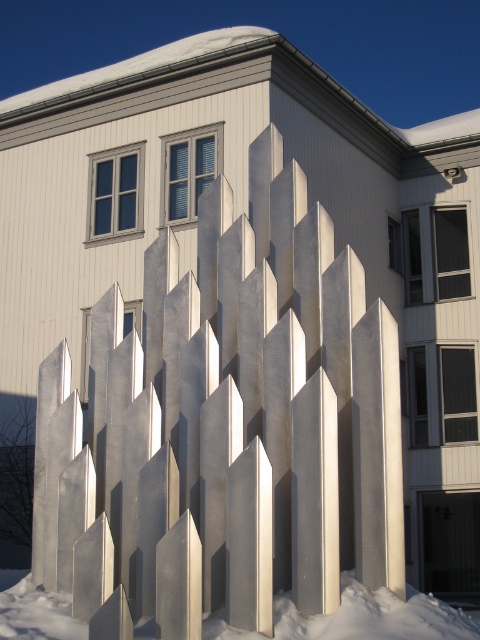
Is metallic silver fence at center positioned in front of white powdery snow at lower center?

No, it is not.

Is metallic silver fence at center further to camera compared to white powdery snow at lower center?

Yes.

This screenshot has width=480, height=640. I want to click on metallic silver fence at center, so click(227, 428).